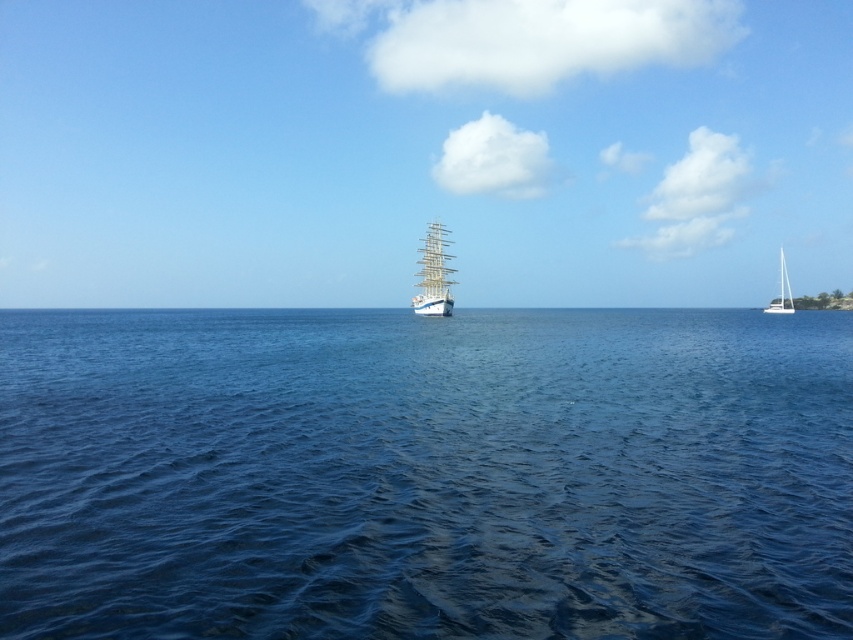
Question: Is blue smooth water at center below white glossy sailboat at right?

Choices:
 (A) yes
 (B) no

Answer: (A)

Question: Does blue smooth water at center have a larger size compared to white glossy sailboat at right?

Choices:
 (A) no
 (B) yes

Answer: (A)

Question: Does white wooden ship at center appear under white glossy sailboat at right?

Choices:
 (A) no
 (B) yes

Answer: (B)

Question: Which of these objects is positioned farthest from the white glossy sailboat at right?

Choices:
 (A) blue smooth water at center
 (B) white wooden ship at center

Answer: (A)

Question: Among these objects, which one is nearest to the camera?

Choices:
 (A) white glossy sailboat at right
 (B) blue smooth water at center
 (C) white wooden ship at center

Answer: (B)

Question: Which point appears farthest from the camera in this image?

Choices:
 (A) (178, 492)
 (B) (419, 259)
 (C) (781, 252)

Answer: (C)